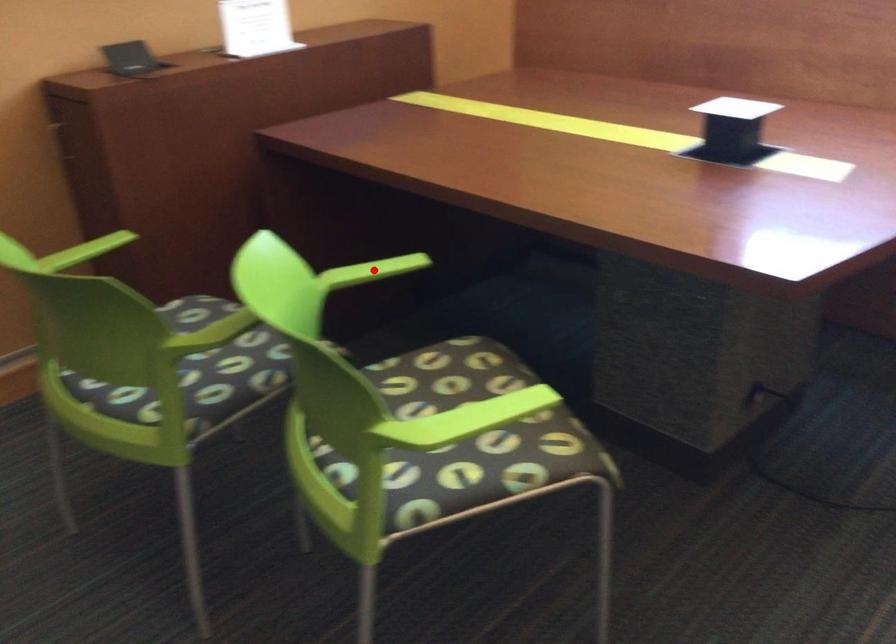
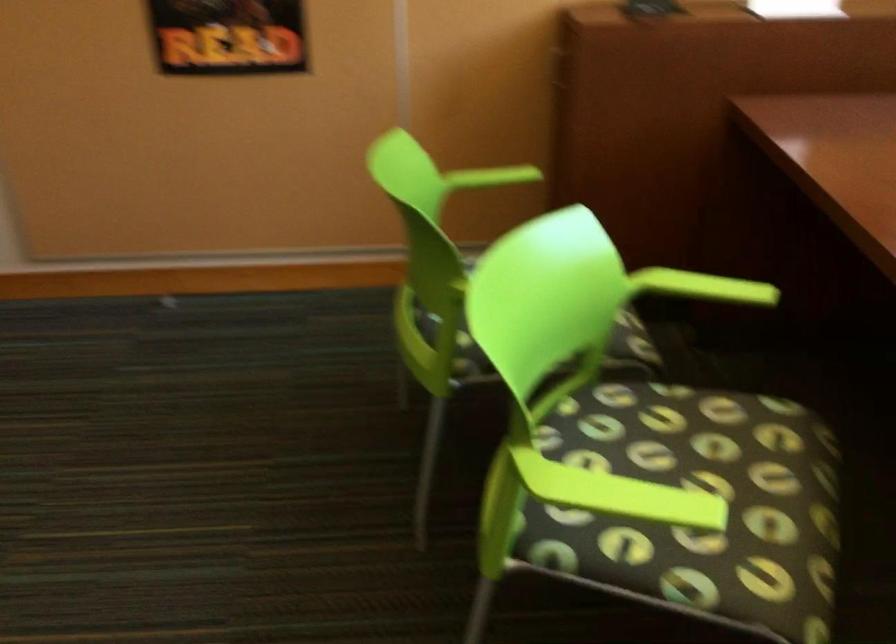
Locate, in the second image, the point that corresponds to the highlighted location in the first image.

(702, 287)